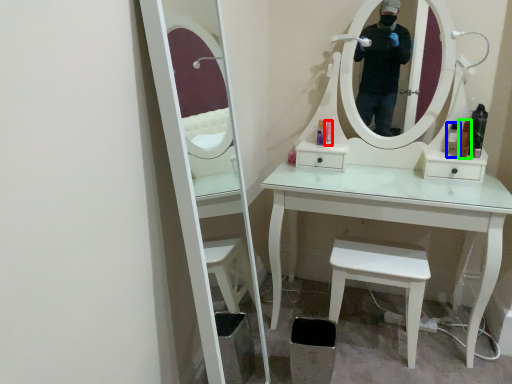
Question: Estimate the real-world distances between objects in this image. Which object is farther from toiletry (highlighted by a red box), toiletry (highlighted by a blue box) or toiletry (highlighted by a green box)?

Choices:
 (A) toiletry
 (B) toiletry

Answer: (B)